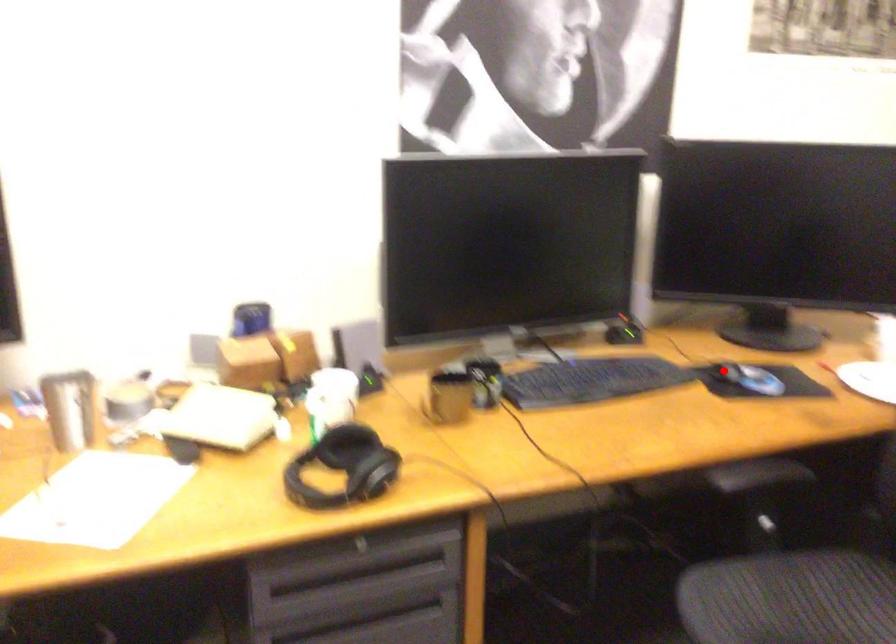
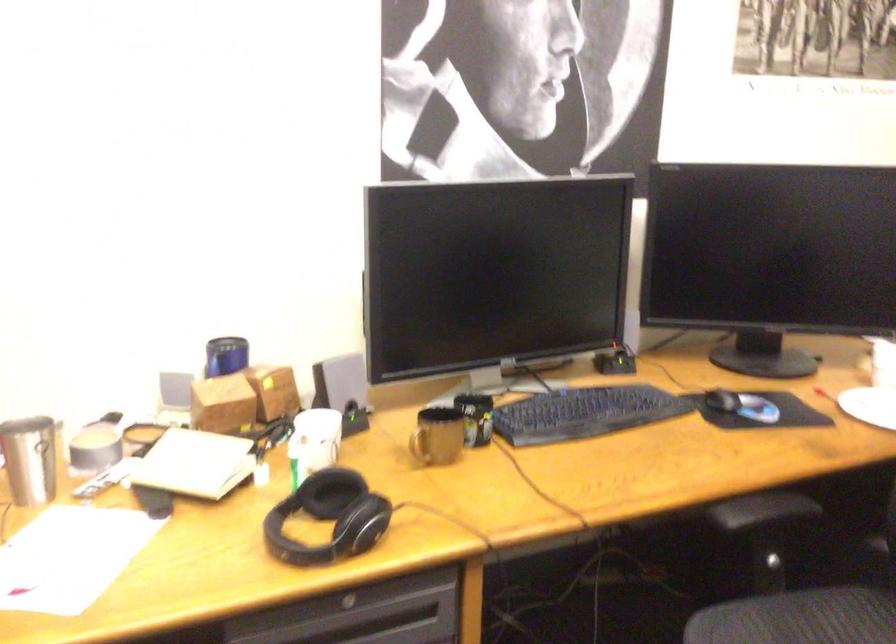
In the second image, find the point that corresponds to the highlighted location in the first image.

(721, 400)